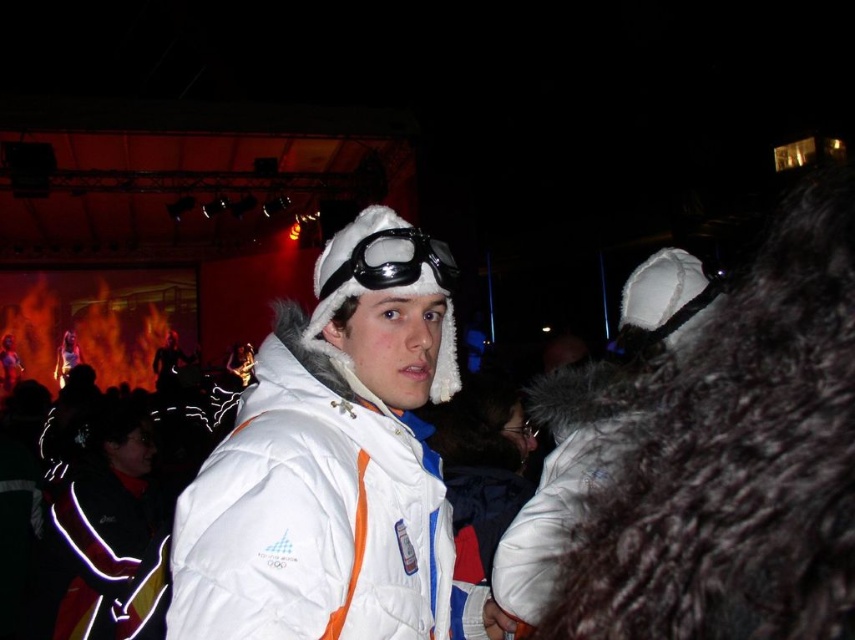
Between white puffy jacket at center and white fur goggles at center, which one is positioned lower?

white puffy jacket at center is below.

Who is taller, white puffy jacket at center or white fur goggles at center?

With more height is white puffy jacket at center.

Measure the distance between point (410, 500) and camera.

Point (410, 500) and camera are 5.33 feet apart.

I want to click on white puffy jacket at center, so click(314, 515).

Is white fur coat at center smaller than white fur goggles at center?

No.

Who is lower down, white fur coat at center or white fur goggles at center?

white fur coat at center is below.

Who is more forward, [528,616] or [364,282]?

Point [364,282] is in front.

Locate an element on the screen. This screenshot has height=640, width=855. white fur coat at center is located at coordinates (590, 422).

Can you confirm if white puffy jacket at center is positioned to the right of white fur coat at center?

No, white puffy jacket at center is not to the right of white fur coat at center.

Describe the element at coordinates (314, 515) in the screenshot. The width and height of the screenshot is (855, 640). I see `white puffy jacket at center` at that location.

Locate an element on the screen. This screenshot has width=855, height=640. white puffy jacket at center is located at coordinates (314, 515).

Where is `white puffy jacket at center`? white puffy jacket at center is located at coordinates (314, 515).